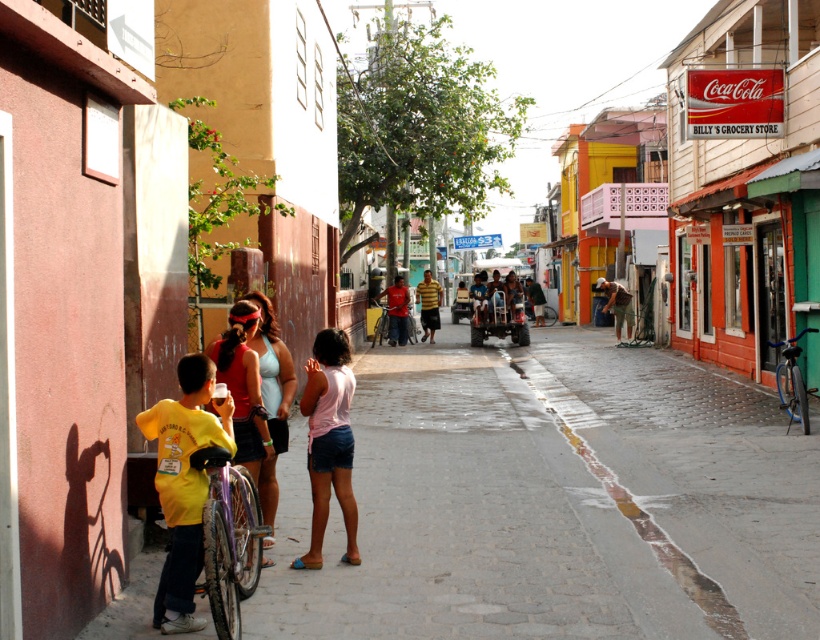
Question: Which point is farther to the camera?

Choices:
 (A) pink cotton tank top at center
 (B) metallic silver cart at center
 (C) matte pink headband at center

Answer: (B)

Question: Is orange wooden billy's grocery store at right bigger than matte blue shirt at center?

Choices:
 (A) no
 (B) yes

Answer: (B)

Question: Can you confirm if metallic bicycle at left is positioned to the left of brown leather jacket at center?

Choices:
 (A) yes
 (B) no

Answer: (A)

Question: Is orange wooden billy's grocery store at right closer to the viewer compared to matte pink headband at center?

Choices:
 (A) yes
 (B) no

Answer: (B)

Question: Which object appears closest to the camera in this image?

Choices:
 (A) brown leather jacket at center
 (B) matte pink headband at center
 (C) yellow matte shirt at lower left

Answer: (C)

Question: Which point is closer to the camera taking this photo?

Choices:
 (A) (786, 129)
 (B) (399, 337)
 (C) (238, 445)
 (D) (490, 282)

Answer: (C)